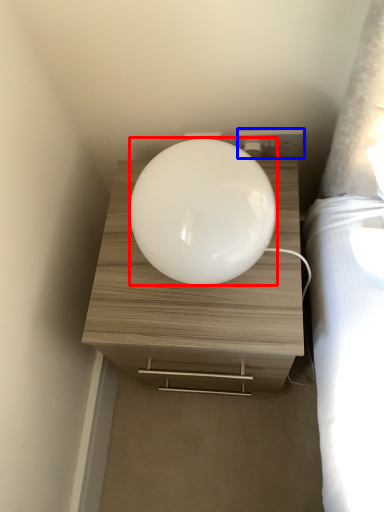
Question: Which object appears farthest to the camera in this image, oval (highlighted by a red box) or electric outlet (highlighted by a blue box)?

Choices:
 (A) oval
 (B) electric outlet

Answer: (B)